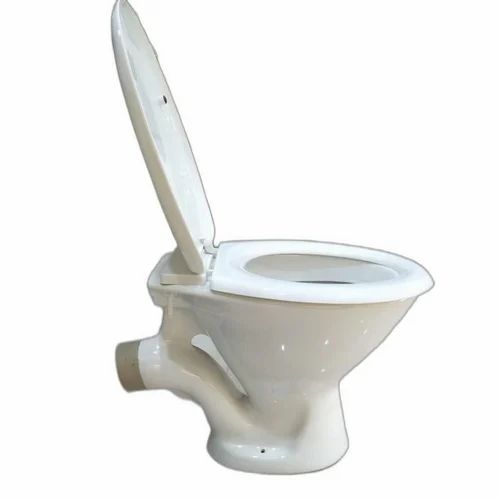
At what (x,y) coordinates should I click in order to perform the action: click on base of toilet. Please return your answer as a coordinate pair (x, y). This screenshot has height=500, width=500. Looking at the image, I should click on point(286,474).